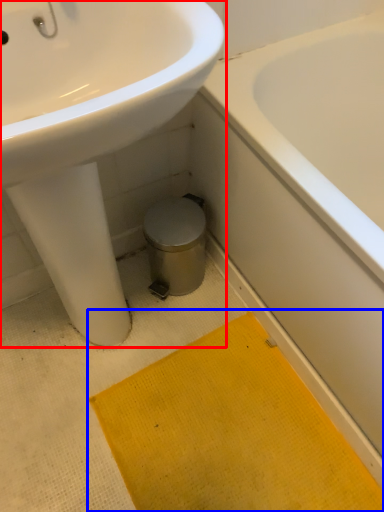
Question: Which point is closer to the camera, sink (highlighted by a red box) or bath mat (highlighted by a blue box)?

Choices:
 (A) sink
 (B) bath mat

Answer: (A)